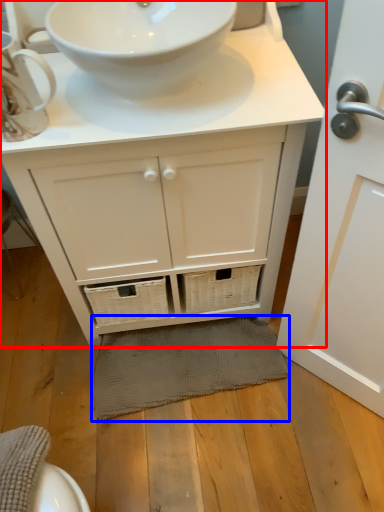
Question: Which of the following is the farthest to the observer, bathroom cabinet (highlighted by a red box) or bath mat (highlighted by a blue box)?

Choices:
 (A) bathroom cabinet
 (B) bath mat

Answer: (B)